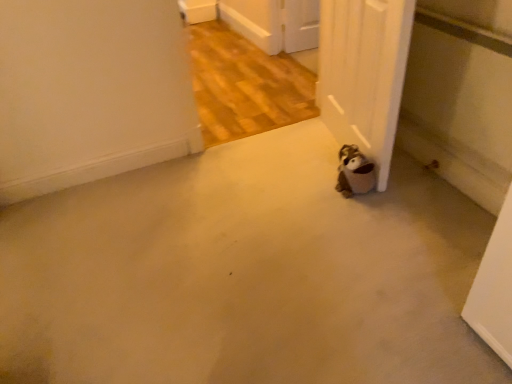
This screenshot has height=384, width=512. What do you see at coordinates (364, 73) in the screenshot?
I see `white matte door at lower right` at bounding box center [364, 73].

Locate an element on the screen. The width and height of the screenshot is (512, 384). white matte door at lower right is located at coordinates (364, 73).

Identify the location of beige carpet at lower center. Image resolution: width=512 pixels, height=384 pixels. (244, 274).

This screenshot has height=384, width=512. In order to click on concrete on the left of brown plush toy at lower right in this screenshot , I will do `click(244, 274)`.

How many degrees apart are the facing directions of beige carpet at lower center and brown plush toy at lower right?

94.4 degrees separate the facing orientations of beige carpet at lower center and brown plush toy at lower right.

Which is more to the left, beige carpet at lower center or brown plush toy at lower right?

Positioned to the left is beige carpet at lower center.

From a real-world perspective, is beige carpet at lower center located beneath brown plush toy at lower right?

Yes, from a real-world perspective, beige carpet at lower center is under brown plush toy at lower right.

How many degrees apart are the facing directions of white matte door at lower right and brown plush toy at lower right?

17.8 degrees separate the facing orientations of white matte door at lower right and brown plush toy at lower right.

From the image's perspective, is white matte door at lower right located above or below brown plush toy at lower right?

From the image's perspective, white matte door at lower right appears above brown plush toy at lower right.

Who is smaller, white matte door at lower right or brown plush toy at lower right?

With smaller size is brown plush toy at lower right.

Are white matte door at lower right and brown plush toy at lower right far apart?

No, white matte door at lower right is in close proximity to brown plush toy at lower right.

Considering the relative positions of brown plush toy at lower right and beige carpet at lower center in the image provided, is brown plush toy at lower right behind beige carpet at lower center?

That is True.

In terms of height, does brown plush toy at lower right look taller or shorter compared to beige carpet at lower center?

Considering their sizes, brown plush toy at lower right has more height than beige carpet at lower center.

Considering the relative sizes of brown plush toy at lower right and beige carpet at lower center in the image provided, is brown plush toy at lower right bigger than beige carpet at lower center?

Incorrect, brown plush toy at lower right is not larger than beige carpet at lower center.

Considering the positions of point (338, 182) and point (241, 353), is point (338, 182) closer or farther from the camera than point (241, 353)?

Clearly, point (338, 182) is more distant from the camera than point (241, 353).

I want to click on concrete that appears in front of the white matte door at lower right, so click(x=244, y=274).

Does beige carpet at lower center have a lesser width compared to white matte door at lower right?

In fact, beige carpet at lower center might be wider than white matte door at lower right.

Between beige carpet at lower center and white matte door at lower right, which one has less height?

Standing shorter between the two is beige carpet at lower center.

Is beige carpet at lower center outside of white matte door at lower right?

beige carpet at lower center is positioned outside white matte door at lower right.

Considering the points (356, 171) and (396, 12), which point is behind, point (356, 171) or point (396, 12)?

The point (356, 171) is behind.

Considering the positions of objects brown plush toy at lower right and white matte door at lower right in the image provided, who is more to the left, brown plush toy at lower right or white matte door at lower right?

Positioned to the left is brown plush toy at lower right.

Who is more distant, brown plush toy at lower right or white matte door at lower right?

brown plush toy at lower right is more distant.

Is brown plush toy at lower right looking in the opposite direction of white matte door at lower right?

Correct, brown plush toy at lower right is looking away from white matte door at lower right.

Between point (326, 39) and point (251, 204), which one is positioned behind?

Point (326, 39)

How different are the orientations of white matte door at lower right and beige carpet at lower center in degrees?

The facing directions of white matte door at lower right and beige carpet at lower center are 76.6 degrees apart.

Can beige carpet at lower center be found inside white matte door at lower right?

Actually, beige carpet at lower center is outside white matte door at lower right.

Considering the sizes of objects white matte door at lower right and beige carpet at lower center in the image provided, who is shorter, white matte door at lower right or beige carpet at lower center?

Standing shorter between the two is beige carpet at lower center.

Locate an element on the screen. concrete that appears below the brown plush toy at lower right (from a real-world perspective) is located at coordinates (244, 274).

Find the location of a particular element. The image size is (512, 384). door above the brown plush toy at lower right (from the image's perspective) is located at coordinates (364, 73).

Estimate the real-world distances between objects in this image. Which object is closer to brown plush toy at lower right, beige carpet at lower center or white matte door at lower right?

Among the two, white matte door at lower right is located nearer to brown plush toy at lower right.

Looking at the image, which one is located closer to white matte door at lower right, beige carpet at lower center or brown plush toy at lower right?

brown plush toy at lower right is closer to white matte door at lower right.

Estimate the real-world distances between objects in this image. Which object is further from beige carpet at lower center, white matte door at lower right or brown plush toy at lower right?

white matte door at lower right lies further to beige carpet at lower center than the other object.

Looking at the image, which one is located further to white matte door at lower right, brown plush toy at lower right or beige carpet at lower center?

beige carpet at lower center.

Estimate the real-world distances between objects in this image. Which object is closer to brown plush toy at lower right, white matte door at lower right or beige carpet at lower center?

white matte door at lower right.

Consider the image. Which object lies nearer to the anchor point beige carpet at lower center, brown plush toy at lower right or white matte door at lower right?

brown plush toy at lower right.

The width and height of the screenshot is (512, 384). I want to click on door located between beige carpet at lower center and brown plush toy at lower right in the depth direction, so click(x=364, y=73).